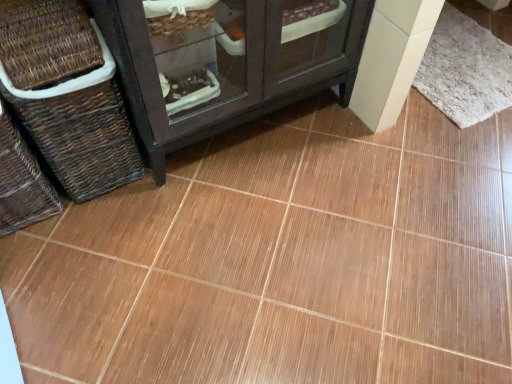
Where is `free location in front of brown woven basket at left, the first basket from the right`? This screenshot has width=512, height=384. free location in front of brown woven basket at left, the first basket from the right is located at coordinates (94, 236).